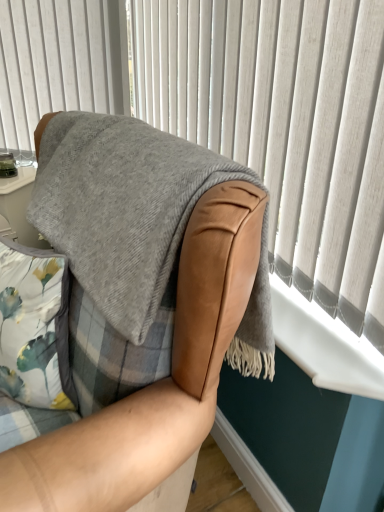
Question: From the image's perspective, is leather armchair at center positioned above or below white plastic window sill at lower right?

Choices:
 (A) above
 (B) below

Answer: (B)

Question: In the image, is leather armchair at center on the left side or the right side of white plastic window sill at lower right?

Choices:
 (A) right
 (B) left

Answer: (B)

Question: Which object is positioned farthest from the white plastic window sill at lower right?

Choices:
 (A) gray woolen blanket at upper right
 (B) leather armchair at center

Answer: (B)

Question: Which of these objects is positioned closest to the leather armchair at center?

Choices:
 (A) gray woolen blanket at upper right
 (B) white plastic window sill at lower right

Answer: (B)